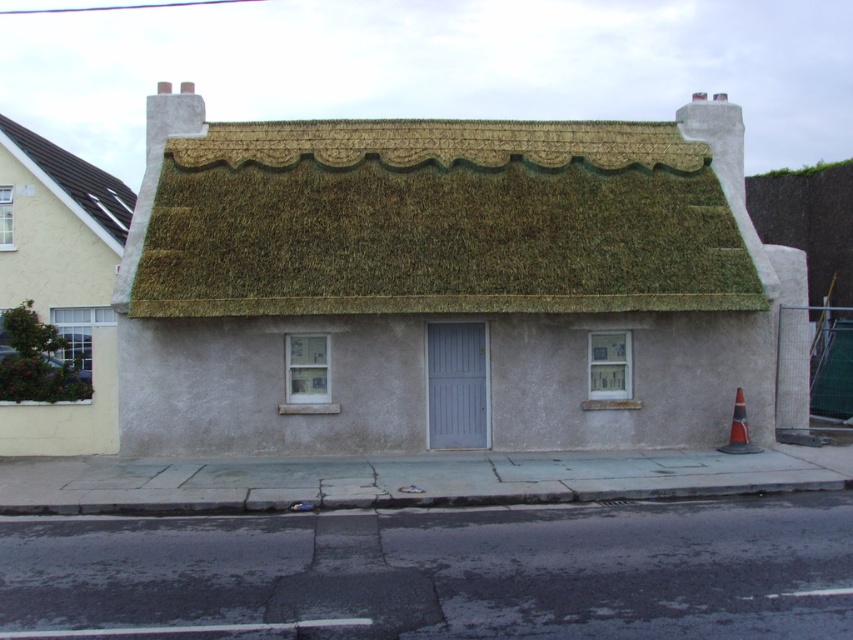
Is thatched roof cottage at center smaller than matte white house at left?

Correct, thatched roof cottage at center occupies less space than matte white house at left.

Can you confirm if thatched roof cottage at center is taller than matte white house at left?

No.

Identify the location of thatched roof cottage at center. The width and height of the screenshot is (853, 640). (444, 285).

Locate an element on the screen. The width and height of the screenshot is (853, 640). thatched roof cottage at center is located at coordinates (444, 285).

Who is positioned more to the left, matte white house at left or dark brown shingles at upper left?

dark brown shingles at upper left is more to the left.

Does matte white house at left have a larger size compared to dark brown shingles at upper left?

Actually, matte white house at left might be smaller than dark brown shingles at upper left.

Which is behind, point (106, 397) or point (28, 150)?

The point (28, 150) is behind.

This screenshot has height=640, width=853. Find the location of `matte white house at left`. matte white house at left is located at coordinates (61, 284).

Is point (256, 205) positioned behind point (36, 163)?

That is False.

The image size is (853, 640). In order to click on thatched roof cottage at center in this screenshot , I will do [x=444, y=285].